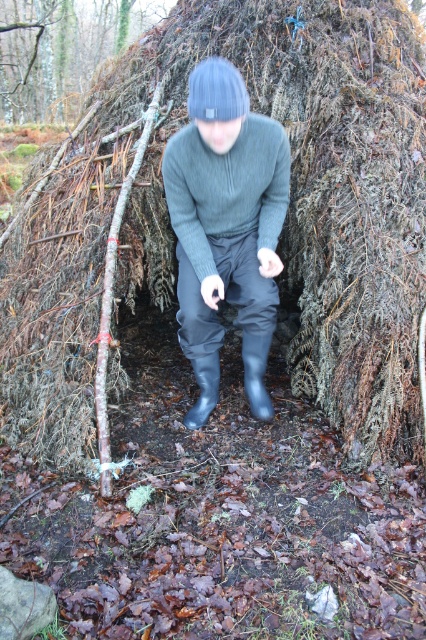
Who is shorter, brown rough bark at upper left or rubber boot at lower center?

rubber boot at lower center

Is point (26, 42) closer to camera compared to point (189, 413)?

No, (26, 42) is behind (189, 413).

Locate an element on the screen. brown rough bark at upper left is located at coordinates (62, 51).

Is brown rough bark at upper left below blue rubber boot at center?

Actually, brown rough bark at upper left is above blue rubber boot at center.

Which is above, brown rough bark at upper left or blue rubber boot at center?

brown rough bark at upper left is above.

At what (x,y) coordinates should I click in order to perform the action: click on brown rough bark at upper left. Please return your answer as a coordinate pair (x, y). Looking at the image, I should click on (62, 51).

This screenshot has height=640, width=426. I want to click on brown rough bark at upper left, so click(62, 51).

Does point (250, 396) come in front of point (207, 410)?

No, (250, 396) is behind (207, 410).

Is blue rubber boot at center to the right of rubber boot at lower center from the viewer's perspective?

Indeed, blue rubber boot at center is positioned on the right side of rubber boot at lower center.

Does point (241, 355) lie in front of point (186, 422)?

No, it is not.

Where is `blue rubber boot at center`? This screenshot has width=426, height=640. blue rubber boot at center is located at coordinates (256, 372).